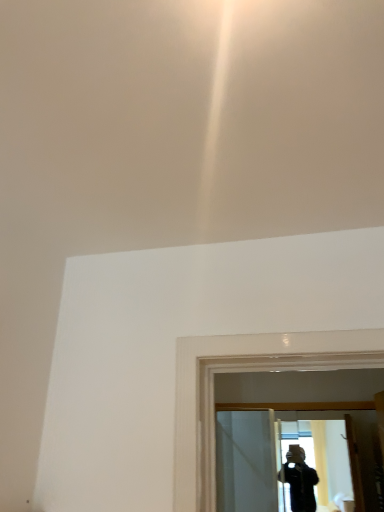
Where is `clear glass mirror at center`? clear glass mirror at center is located at coordinates (297, 438).

What do you see at coordinates (297, 438) in the screenshot? This screenshot has height=512, width=384. I see `clear glass mirror at center` at bounding box center [297, 438].

Locate an element on the screen. The image size is (384, 512). clear glass mirror at center is located at coordinates (297, 438).